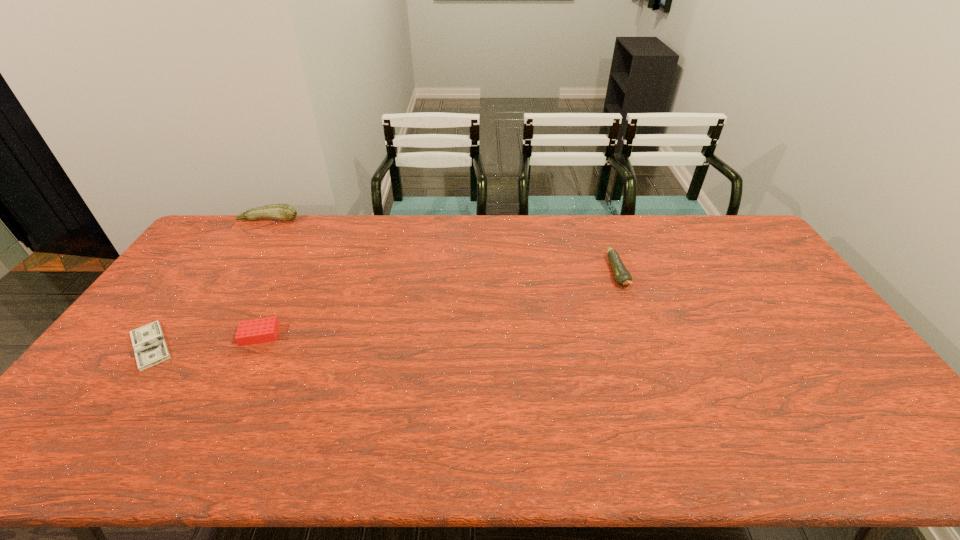
Find the location of a particular element. The image size is (960, 540). blank space located 0.120m on the front of the dollar is located at coordinates (103, 411).

The image size is (960, 540). Find the location of `object located in the far edge section of the desktop`. object located in the far edge section of the desktop is located at coordinates (285, 212).

Locate an element on the screen. The image size is (960, 540). zucchini that is at the left edge is located at coordinates (285, 212).

Image resolution: width=960 pixels, height=540 pixels. Identify the location of dollar that is positioned at the left edge. (149, 345).

Where is `object that is at the far left corner`? The width and height of the screenshot is (960, 540). object that is at the far left corner is located at coordinates (285, 212).

The height and width of the screenshot is (540, 960). In order to click on vacant space at the far edge in this screenshot , I will do `click(656, 247)`.

Locate an element on the screen. This screenshot has width=960, height=540. blank space at the near edge is located at coordinates (357, 430).

Locate an element on the screen. The image size is (960, 540). vacant position at the right edge of the desktop is located at coordinates (776, 264).

Image resolution: width=960 pixels, height=540 pixels. In the image, there is a desktop. Find the location of `vacant area at the near left corner`. vacant area at the near left corner is located at coordinates [59, 462].

In the image, there is a desktop. Identify the location of vacant space at the far right corner. Image resolution: width=960 pixels, height=540 pixels. (726, 217).